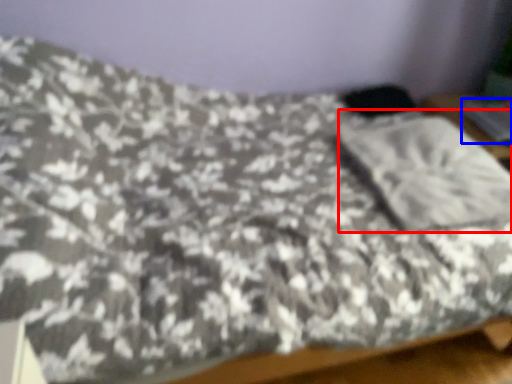
Question: Which object is closer to the camera taking this photo, pillow (highlighted by a red box) or silver (highlighted by a blue box)?

Choices:
 (A) pillow
 (B) silver

Answer: (A)